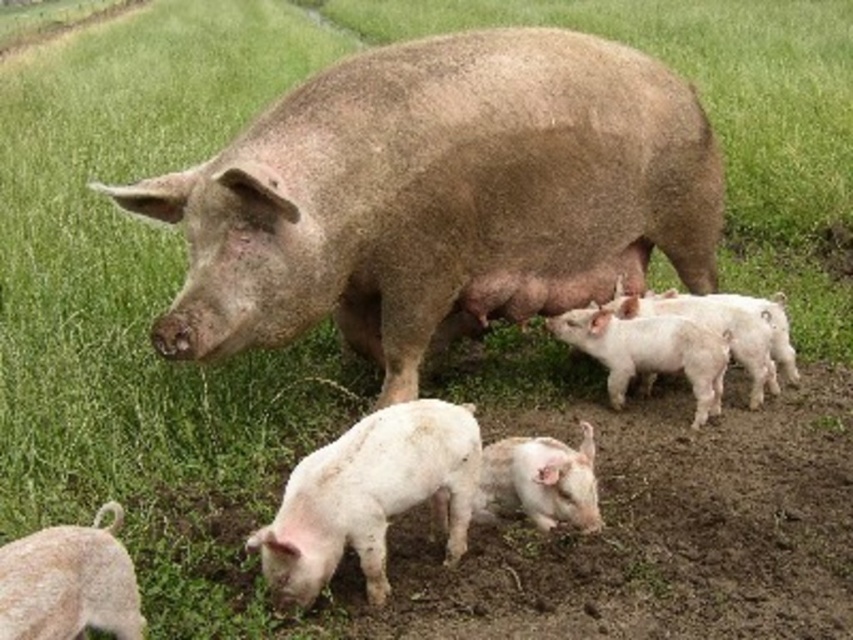
Can you confirm if white matte piglet at lower center is thinner than white matte piglets at center?

Yes.

Who is higher up, white matte piglet at lower center or white matte piglets at center?

white matte piglets at center is higher up.

The image size is (853, 640). What do you see at coordinates (369, 497) in the screenshot?
I see `white matte piglet at lower center` at bounding box center [369, 497].

Where is `white matte piglet at lower center`? white matte piglet at lower center is located at coordinates coord(369,497).

Between white fluffy piglet at lower left and white soft piglet at lower center, which one appears on the right side from the viewer's perspective?

From the viewer's perspective, white soft piglet at lower center appears more on the right side.

Locate an element on the screen. The height and width of the screenshot is (640, 853). white fluffy piglet at lower left is located at coordinates (68, 582).

The image size is (853, 640). In order to click on white fluffy piglet at lower left in this screenshot , I will do `click(68, 582)`.

Can you confirm if white matte piglet at lower center is smaller than white soft piglet at lower center?

Incorrect, white matte piglet at lower center is not smaller in size than white soft piglet at lower center.

Can you confirm if white matte piglet at lower center is bigger than white soft piglet at lower center?

Yes.

What do you see at coordinates (369, 497) in the screenshot?
I see `white matte piglet at lower center` at bounding box center [369, 497].

What are the coordinates of `white matte piglet at lower center` in the screenshot? It's located at (369, 497).